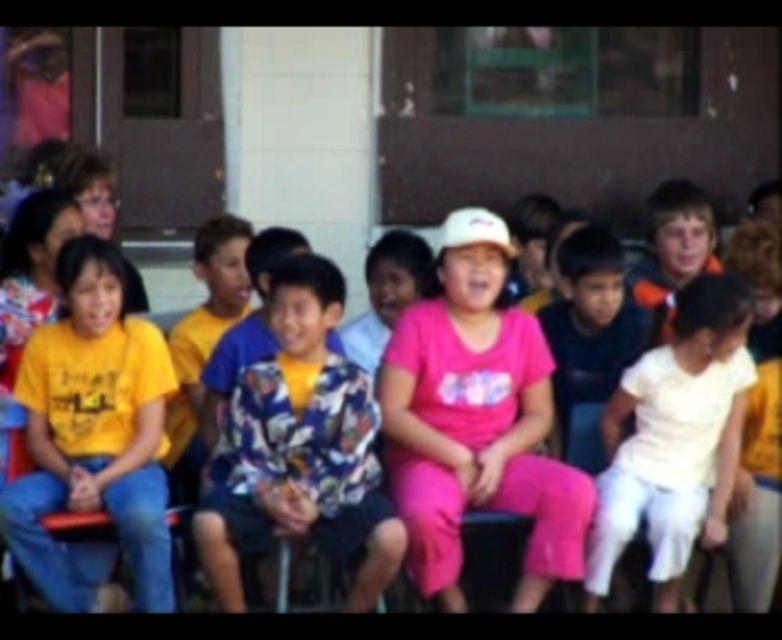
Between point (120, 481) and point (684, 452), which one is positioned in front?

Point (120, 481) is in front.

At what (x,y) coordinates should I click in order to perform the action: click on yellow matte shirt at left. Please return your answer as a coordinate pair (x, y). Looking at the image, I should click on [x=92, y=429].

Identify the location of yellow matte shirt at left. This screenshot has height=640, width=782. (92, 429).

Between pink matte shirt at center and white cotton shirt at right, which one has less height?

white cotton shirt at right

What do you see at coordinates (476, 420) in the screenshot? The image size is (782, 640). I see `pink matte shirt at center` at bounding box center [476, 420].

Image resolution: width=782 pixels, height=640 pixels. I want to click on pink matte shirt at center, so click(x=476, y=420).

Is point (332, 374) positioned behind point (83, 484)?

Yes, point (332, 374) is farther from viewer.

Does point (350, 490) come farther from viewer compared to point (81, 300)?

No, (350, 490) is in front of (81, 300).

Find the location of a particular element. The height and width of the screenshot is (640, 782). floral-patterned shirt at center is located at coordinates (300, 449).